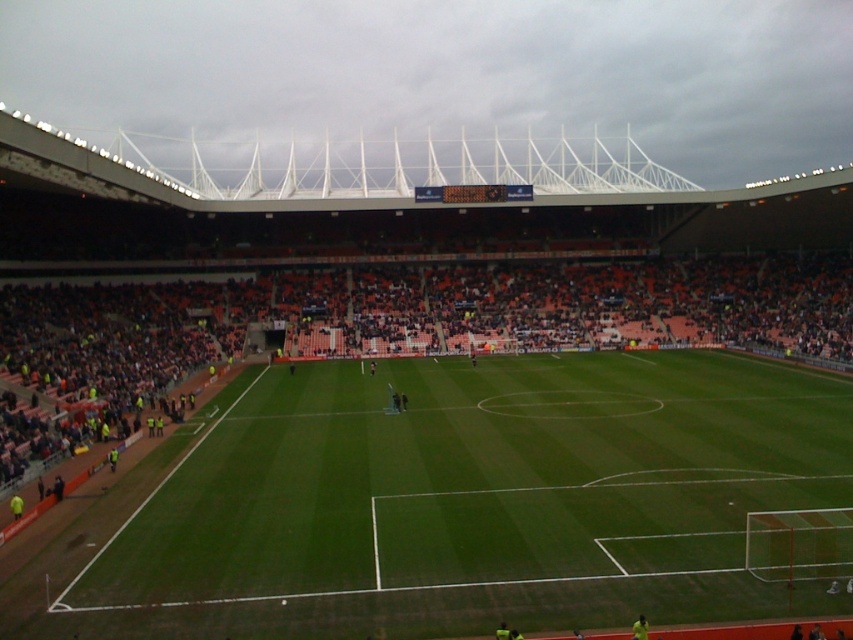
You are a spectator sitting in the orange plastic seats at center. You want to walk directly to the green grass football field at center. Which direction should you walk?

The green grass football field at center is to the left of the orange plastic seats at center, so you should walk to your left to reach it.

You are a drone operator who needs to fly a drone from the green grass football field at center to the orange plastic seats at center. The drone has a maximum flight distance of 25 meters. Can the drone complete the flight without needing to recharge?

The distance between the green grass football field at center and the orange plastic seats at center is 26.50 meters, which exceeds the drone maximum flight distance of 25 meters. The drone cannot complete the flight without recharging.

You are a spectator sitting in the orange plastic seats at center. You want to walk down to the green grass football field at center. Which direction should you go?

The green grass football field at center is located below the orange plastic seats at center, so you should go downward to reach it.